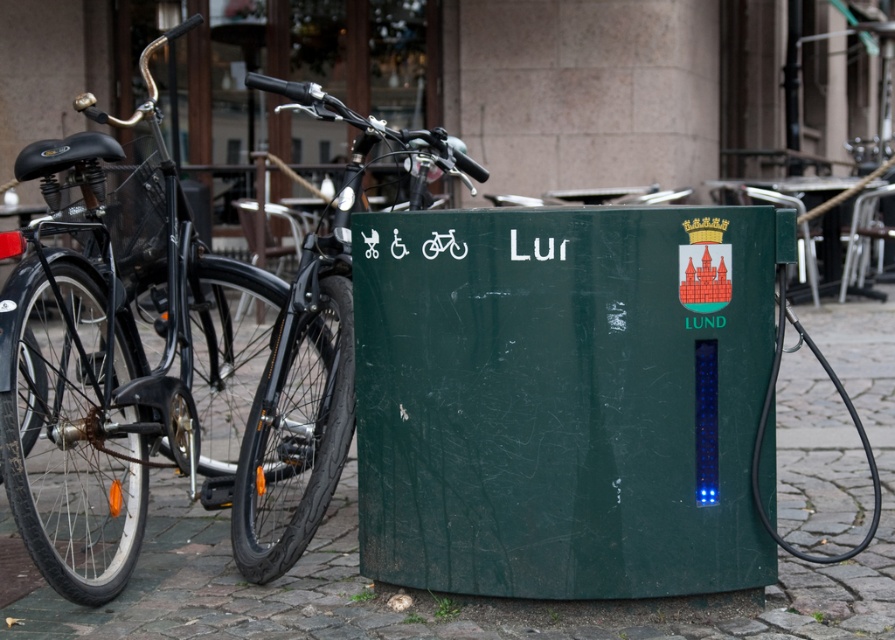
You are standing at the point with coordinates (564, 397) in the street scene. What object are you standing on?

You are standing on the green matte recycling bin at center.

You are standing at the green charging station for electric bicycles in Lund. You see two points marked on the ground near the bicycles. One is at point (632, 588) and the other at point (311, 337). If you want to walk towards the point that is closer to the charging station, which point should you head towards?

Point (311, 337) is closer to the charging station because it is behind point (632, 588), which is in front of it.